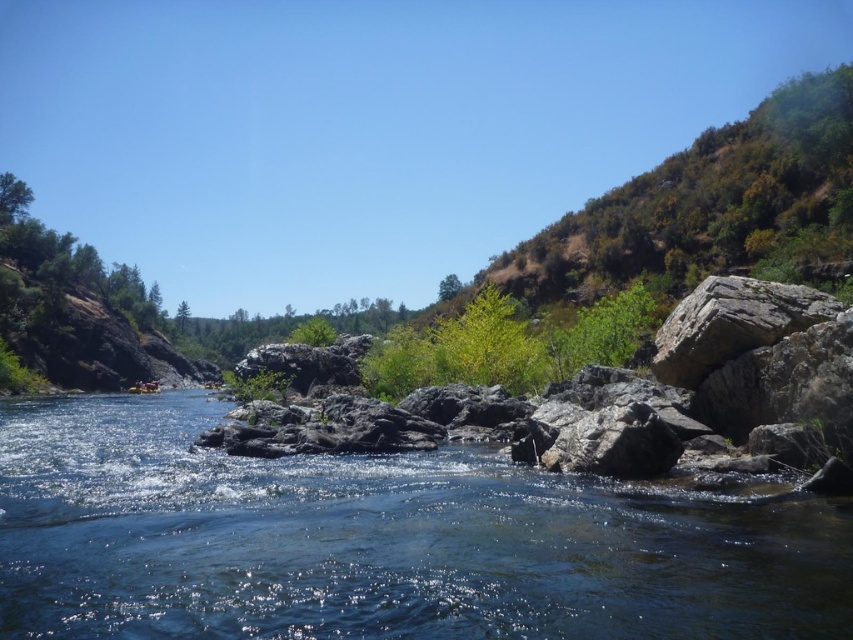
Question: Can you confirm if gray rock at center is positioned to the right of green leafy tree at upper center?

Choices:
 (A) yes
 (B) no

Answer: (B)

Question: Does clear water at center have a smaller size compared to green leafy tree at upper center?

Choices:
 (A) yes
 (B) no

Answer: (A)

Question: Which object is positioned farthest from the gray rock at center?

Choices:
 (A) green leafy tree at upper center
 (B) clear water at center

Answer: (A)

Question: Which of the following is the farthest from the observer?

Choices:
 (A) [x=252, y=634]
 (B) [x=303, y=419]

Answer: (B)

Question: Which object appears closest to the camera in this image?

Choices:
 (A) clear water at center
 (B) gray rock at center
 (C) green leafy tree at upper center

Answer: (A)

Question: Is clear water at center above green leafy tree at upper center?

Choices:
 (A) yes
 (B) no

Answer: (B)